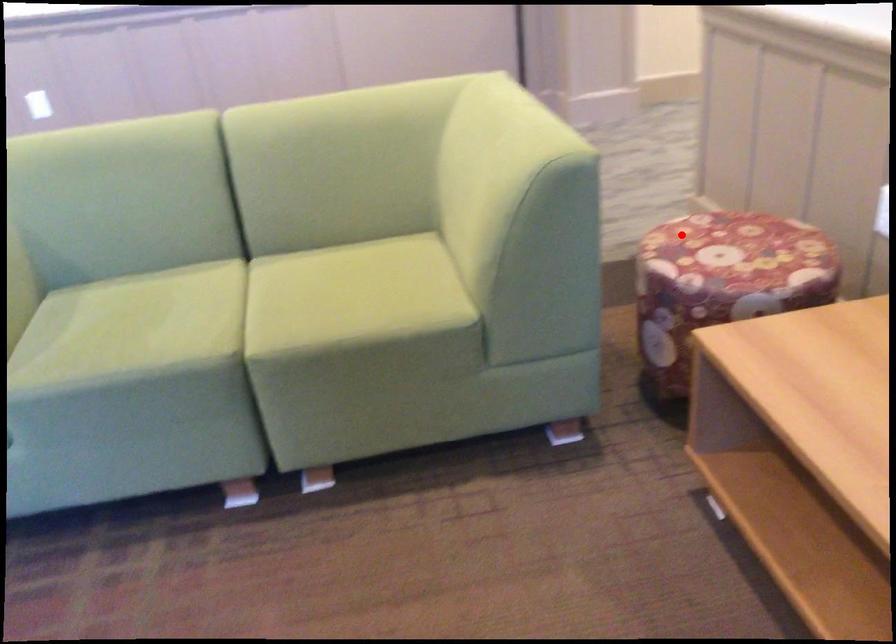
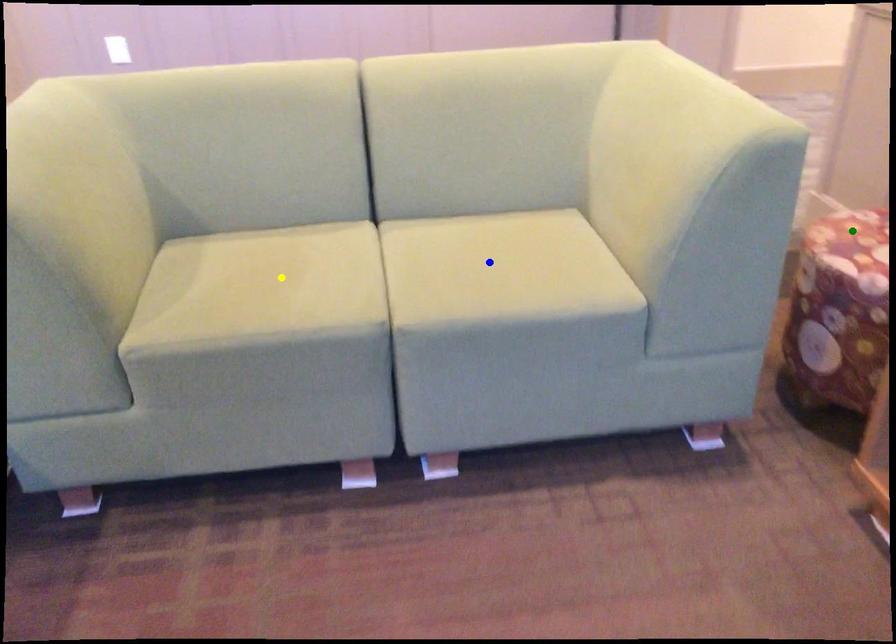
Question: I am providing you with two images of the same scene from different viewpoints. A red point is marked on the first image. You are given multiple points on the second image. Which point in image 2 is actually the same real-world point as the red point in image 1?

Choices:
 (A) blue point
 (B) yellow point
 (C) green point

Answer: (C)